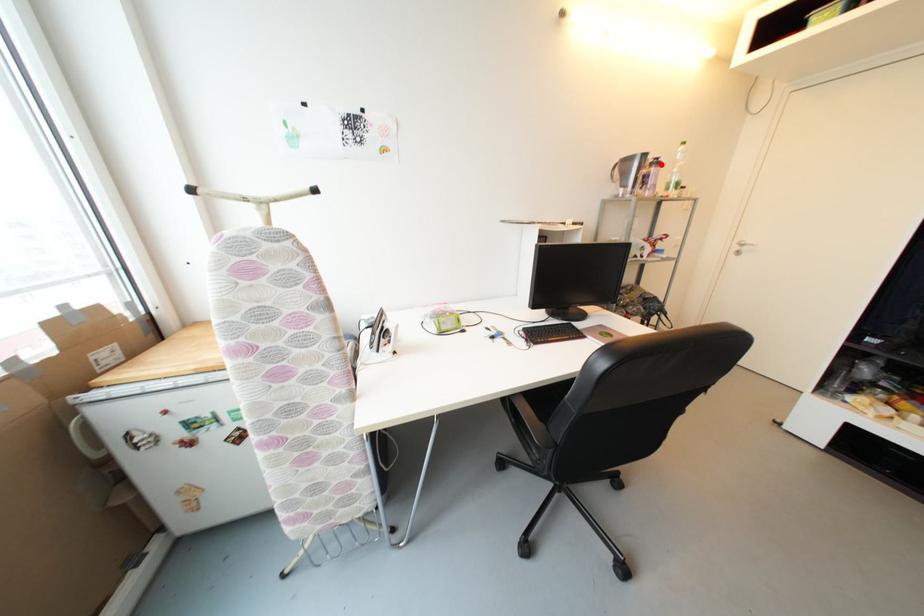
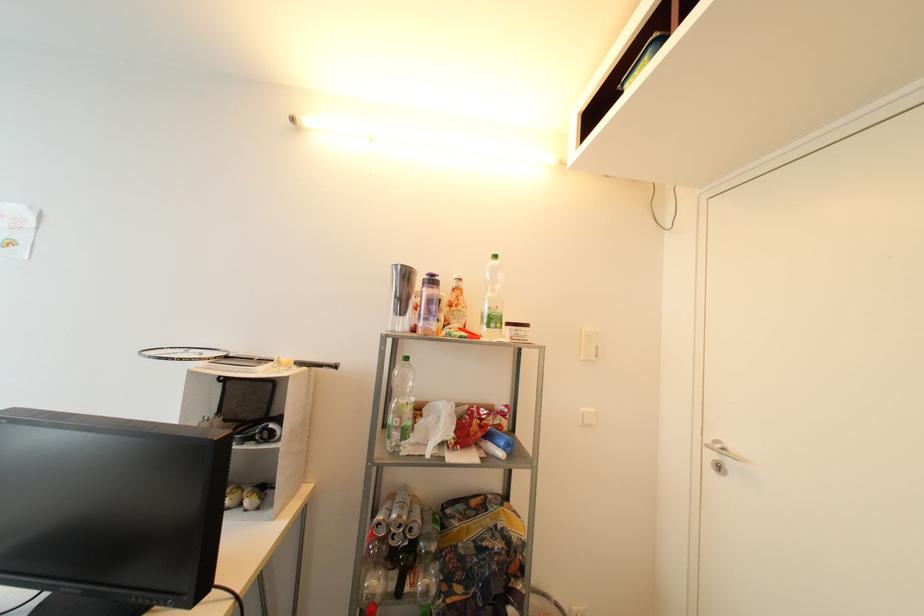
Where in the second image is the point corresponding to the highlighted location from the first image?

(438, 283)